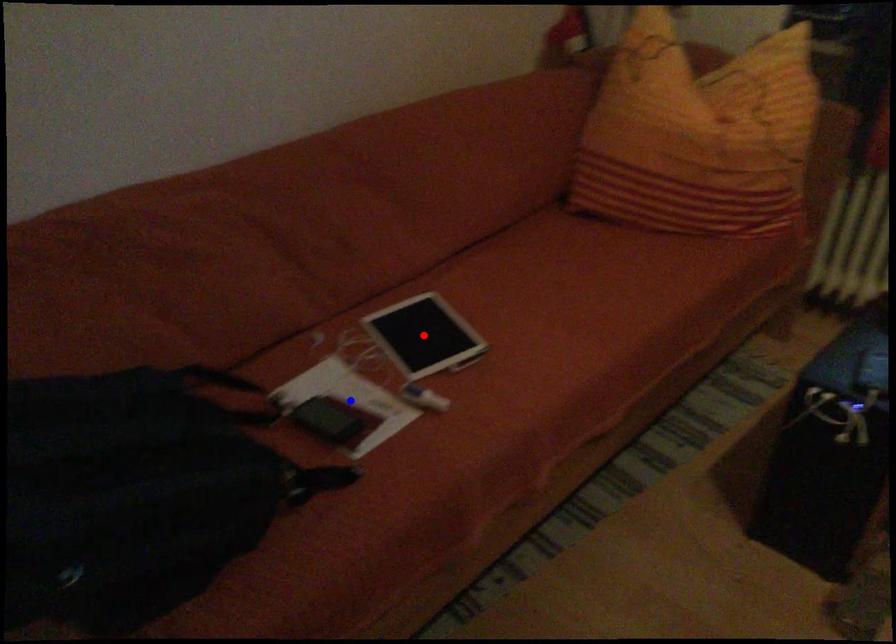
Question: In the image, two points are highlighted. Which point is nearer to the camera? Reply with the corresponding letter.

Choices:
 (A) blue point
 (B) red point

Answer: (A)